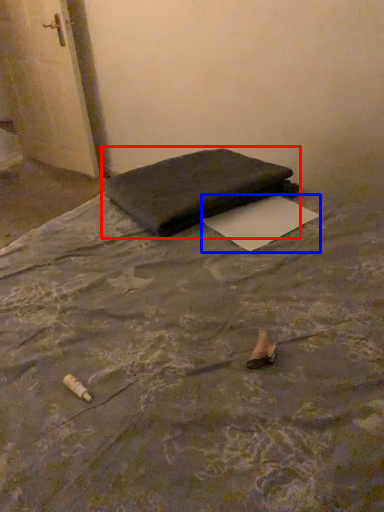
Question: Among these objects, which one is farthest to the camera, furniture (highlighted by a red box) or paper (highlighted by a blue box)?

Choices:
 (A) furniture
 (B) paper

Answer: (A)